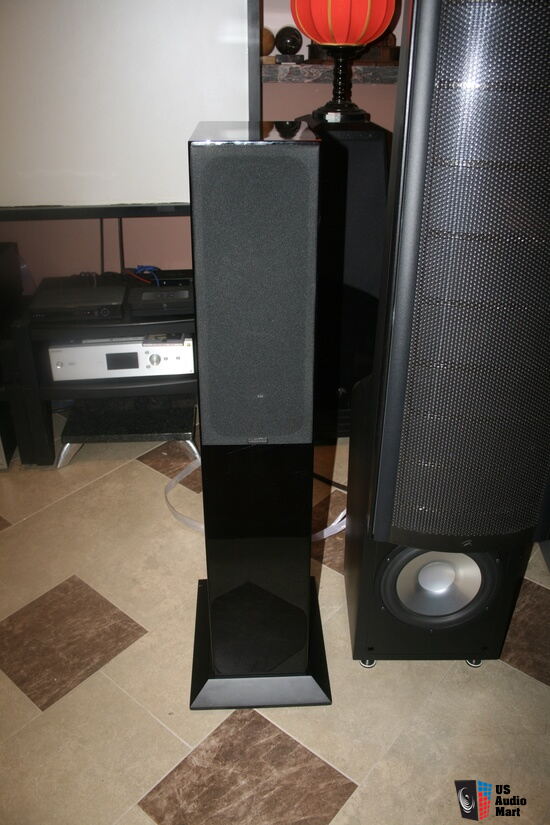
At what (x,y) coordinates should I click in order to perform the action: click on brown marble-like tiles. Please return your answer as a coordinate pair (x, y). This screenshot has width=550, height=825. Looking at the image, I should click on (253, 785), (75, 652), (534, 653), (336, 557), (158, 459).